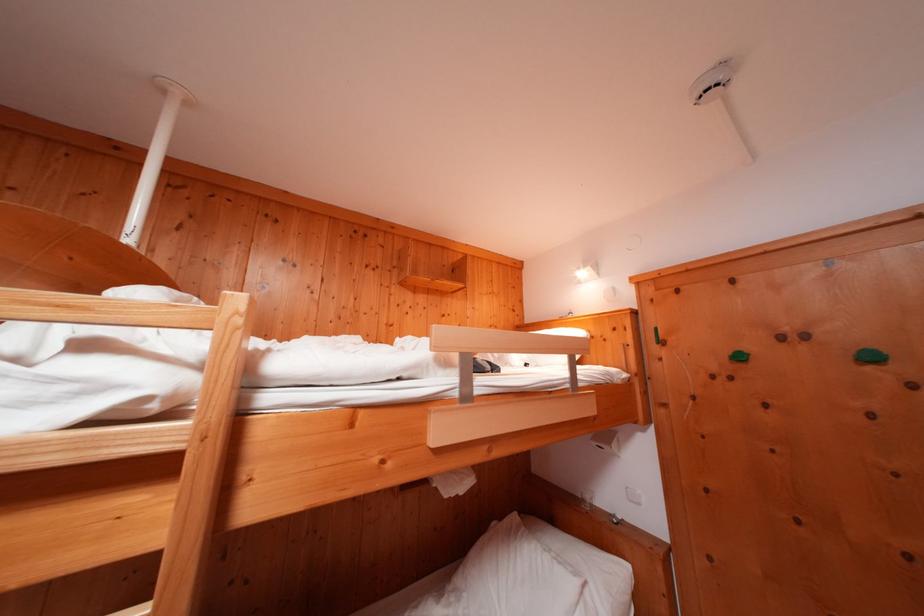
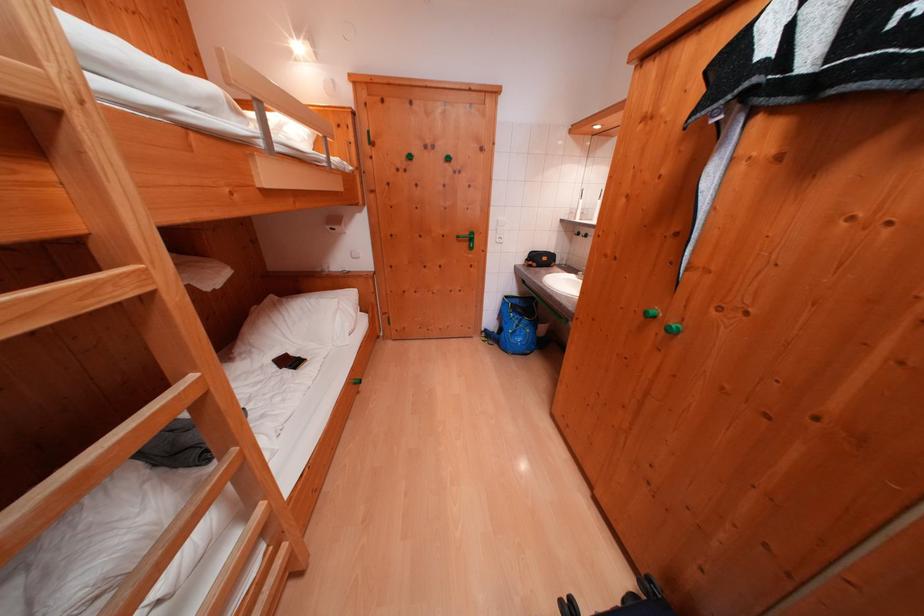
Based on the continuous images, in which direction is the camera rotating?

The rotation direction of the camera is right-down.